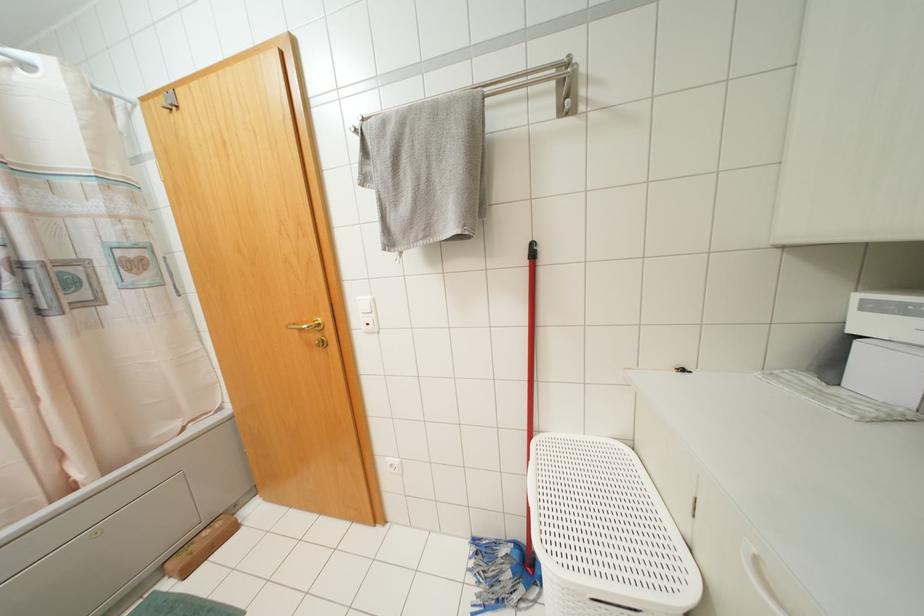
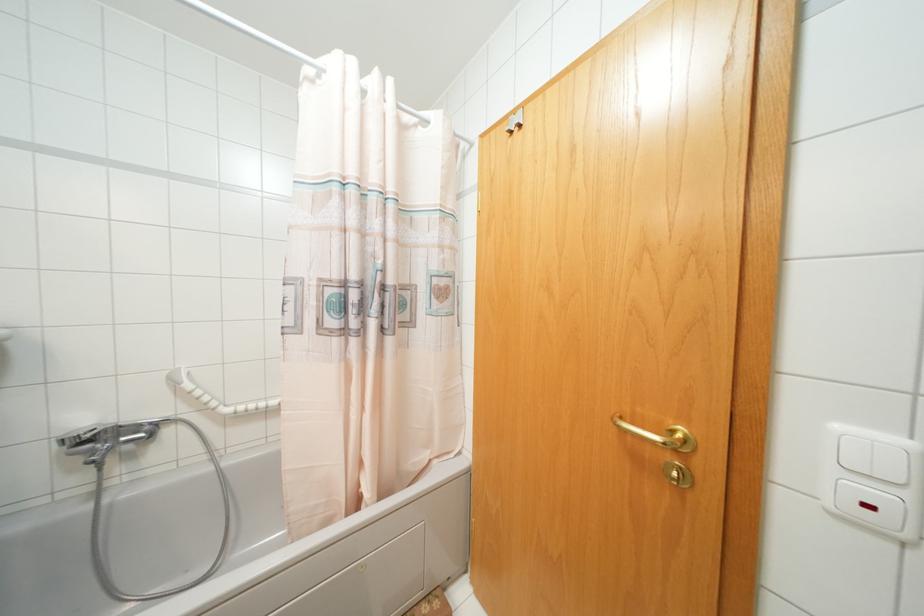
Question: The camera is either moving clockwise (left) or counter-clockwise (right) around the object. The first image is from the beginning of the video and the second image is from the end. Is the camera moving left or right when shooting the video?

Choices:
 (A) Left
 (B) Right

Answer: (B)